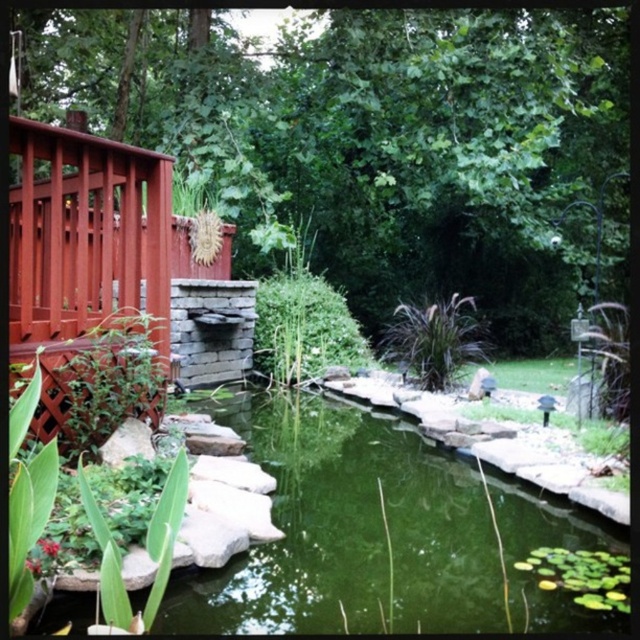
Question: Estimate the real-world distances between objects in this image. Which object is closer to the green leafy plant at center?

Choices:
 (A) green leafy plant at left
 (B) dark green grass at center
 (C) green leafy lily pads at lower right

Answer: (B)

Question: From the image, what is the correct spatial relationship of green leafy plant at left in relation to dark green grass at center?

Choices:
 (A) above
 (B) below

Answer: (A)

Question: Does green leafy plant at left lie in front of green leafy plant at center?

Choices:
 (A) no
 (B) yes

Answer: (B)

Question: Can you confirm if green leafy plant at center is positioned to the right of dark green grass at center?

Choices:
 (A) yes
 (B) no

Answer: (B)

Question: Which object is farther from the camera taking this photo?

Choices:
 (A) dark green grass at center
 (B) green leafy lily pads at lower right

Answer: (A)

Question: Which of these objects is positioned closest to the green leafy plant at left?

Choices:
 (A) green leafy lily pads at lower right
 (B) green leafy plant at center
 (C) dark green grass at center

Answer: (A)